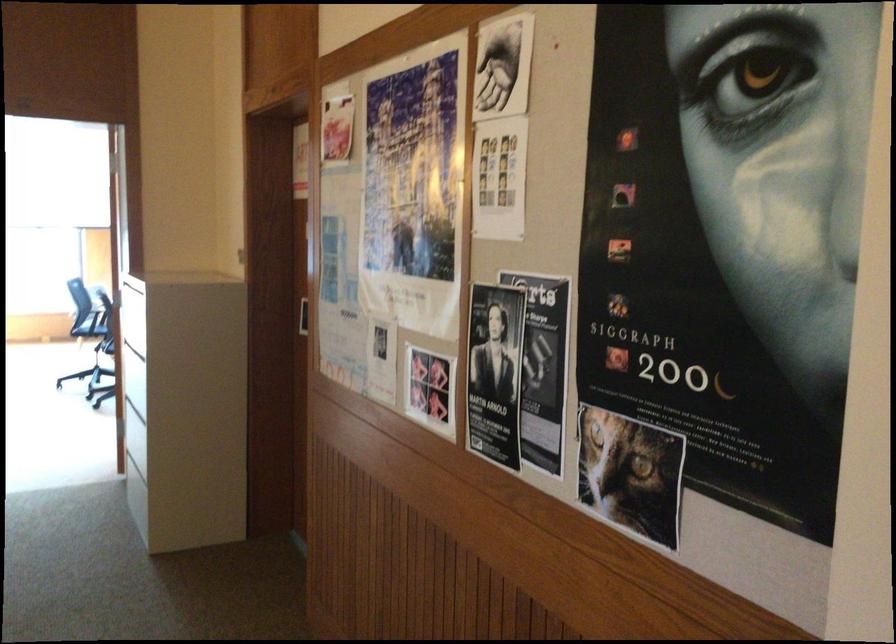
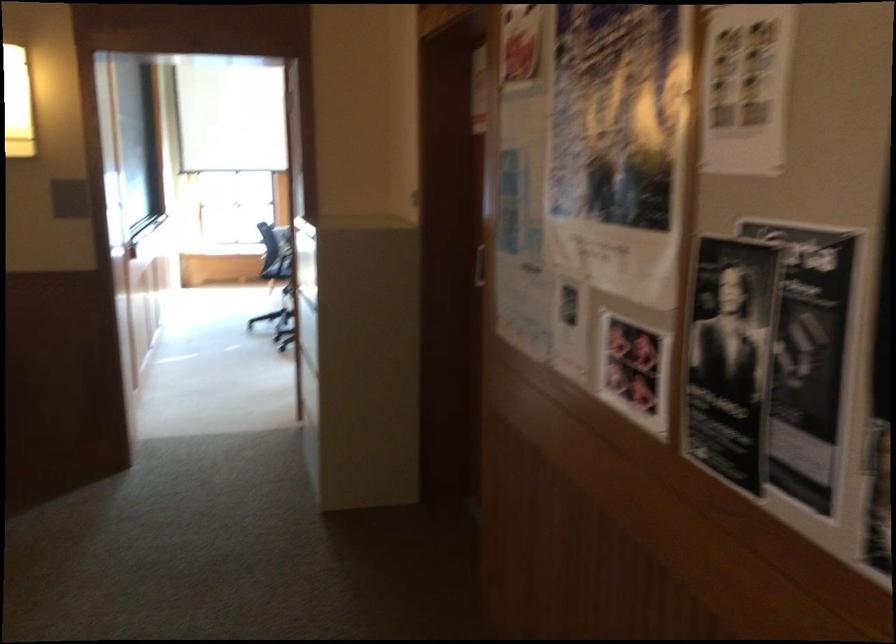
Question: The camera is either moving clockwise (left) or counter-clockwise (right) around the object. The first image is from the beginning of the video and the second image is from the end. Is the camera moving left or right when shooting the video?

Choices:
 (A) Left
 (B) Right

Answer: (B)